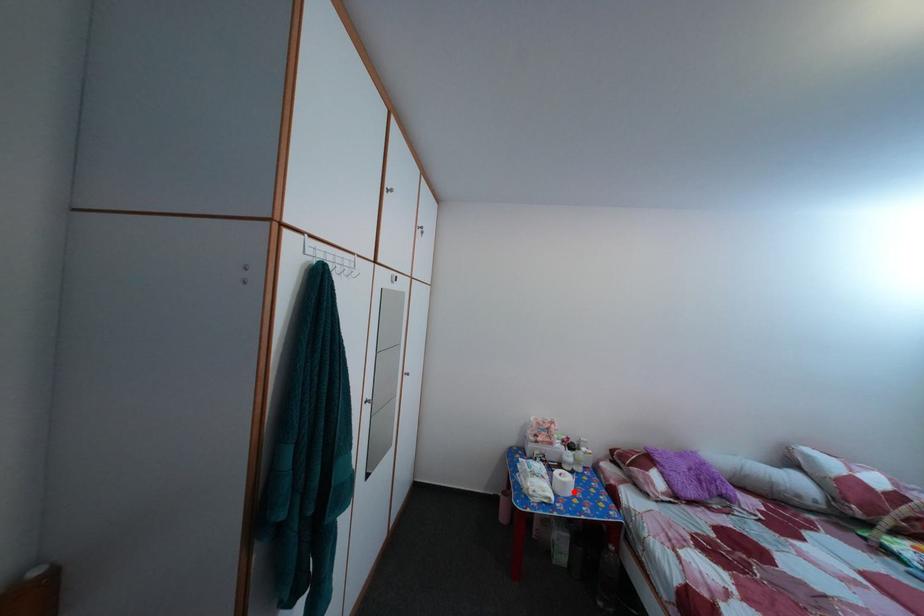
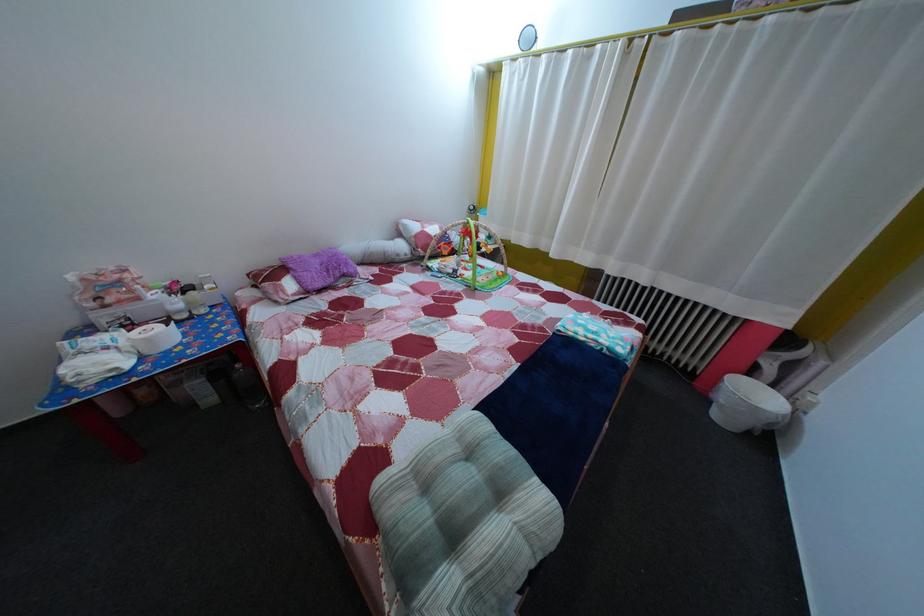
The point at the highlighted location is marked in the first image. Where is the corresponding point in the second image?

(157, 347)